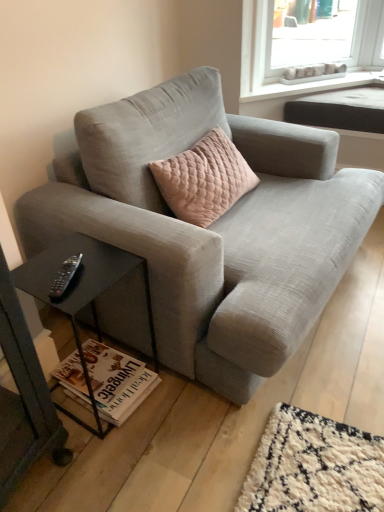
This screenshot has width=384, height=512. In order to click on vacant space to the right of white paper magazine at lower left in this screenshot , I will do `click(172, 399)`.